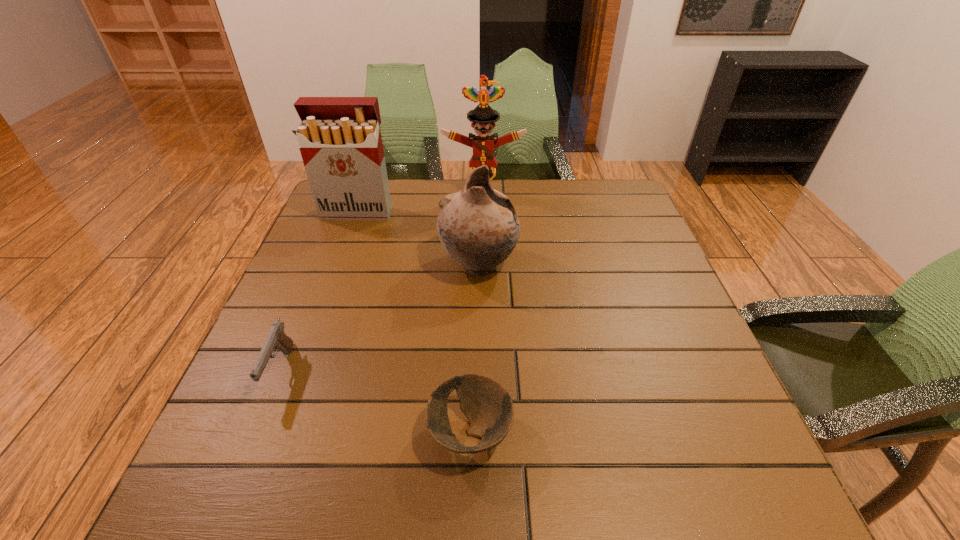
This screenshot has width=960, height=540. I want to click on free space located 0.100m on the right of the bowl, so click(x=567, y=433).

At what (x,y) coordinates should I click in order to perform the action: click on nutcracker at the far edge. Please return your answer as a coordinate pair (x, y). The height and width of the screenshot is (540, 960). Looking at the image, I should click on (483, 117).

Where is `cigarette case present at the far edge`? This screenshot has width=960, height=540. cigarette case present at the far edge is located at coordinates (340, 141).

At what (x,y) coordinates should I click in order to perform the action: click on object at the near edge. Please return your answer as a coordinate pair (x, y). This screenshot has width=960, height=540. Looking at the image, I should click on (488, 406).

Where is `cigarette case that is at the left edge`? The width and height of the screenshot is (960, 540). cigarette case that is at the left edge is located at coordinates (340, 141).

What are the coordinates of `pistol at the left edge` in the screenshot? It's located at (277, 339).

You are a GUI agent. You are given a task and a screenshot of the screen. Output one action in this format:
    pyautogui.click(x=<x>, y=<y>)
    Task: Click on the object at the far left corner
    This screenshot has height=540, width=960.
    Given the screenshot: What is the action you would take?
    pyautogui.click(x=340, y=141)

The image size is (960, 540). I want to click on free region at the far edge of the desktop, so click(572, 205).

This screenshot has height=540, width=960. What are the coordinates of `free space at the near edge` in the screenshot? It's located at (316, 481).

In the image, there is a desktop. Identify the location of vacant space at the left edge. (328, 224).